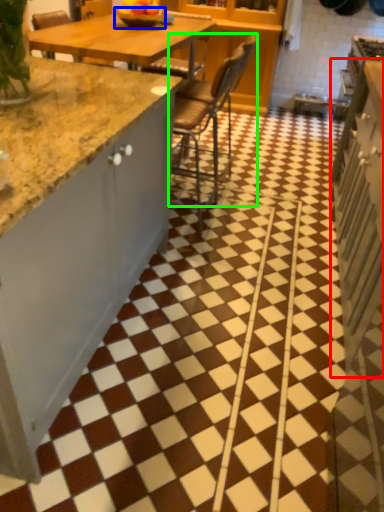
Question: Based on their relative distances, which object is nearer to cabinetry (highlighted by a red box)? Choose from bowl (highlighted by a blue box) and chair (highlighted by a green box).

Choices:
 (A) bowl
 (B) chair

Answer: (B)